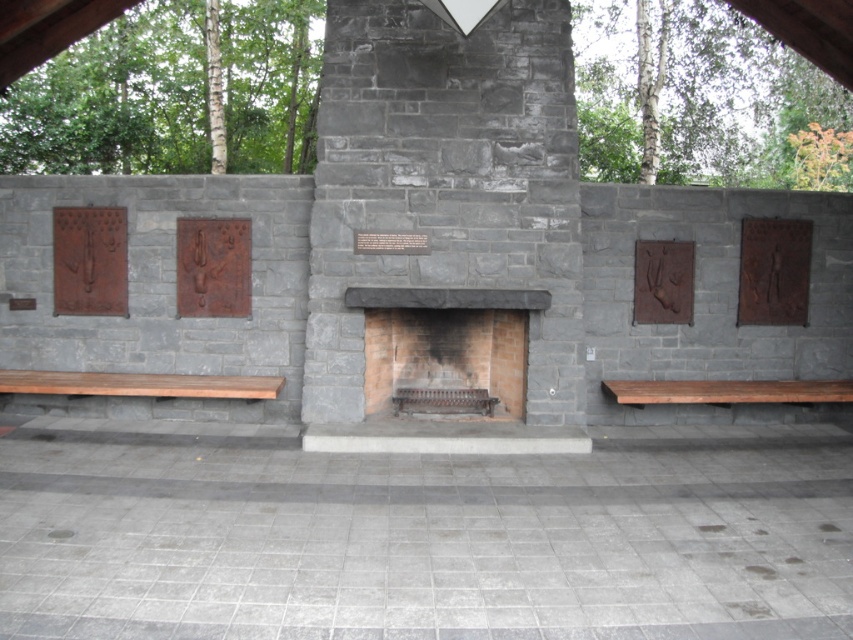
Question: Can you confirm if rusty metal plaque at right is thinner than rustic stone relief at right?

Choices:
 (A) no
 (B) yes

Answer: (A)

Question: Among these objects, which one is nearest to the camera?

Choices:
 (A) brown stone plaque at center
 (B) rustic stone relief at right
 (C) brown wooden bench at left
 (D) brick fireplace at center

Answer: (C)

Question: From the image, what is the correct spatial relationship of rusty metal plaque at left in relation to brown stone plaque at center?

Choices:
 (A) right
 (B) left

Answer: (B)

Question: From the image, what is the correct spatial relationship of dark gray stone fireplace at center in relation to rusty metal plaque at left?

Choices:
 (A) right
 (B) left

Answer: (A)

Question: Which object is positioned closest to the rustic stone relief at right?

Choices:
 (A) rusty metal plaque at right
 (B) rusty metal plaque at left
 (C) brown stone plaque at center

Answer: (A)

Question: Which of the following is the closest to the observer?

Choices:
 (A) 469,173
 (B) 839,381
 (C) 752,244

Answer: (A)